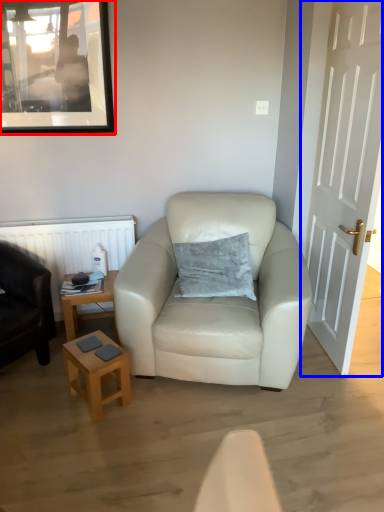
Question: Which of the following is the farthest to the observer, picture frame (highlighted by a red box) or door (highlighted by a blue box)?

Choices:
 (A) picture frame
 (B) door

Answer: (A)